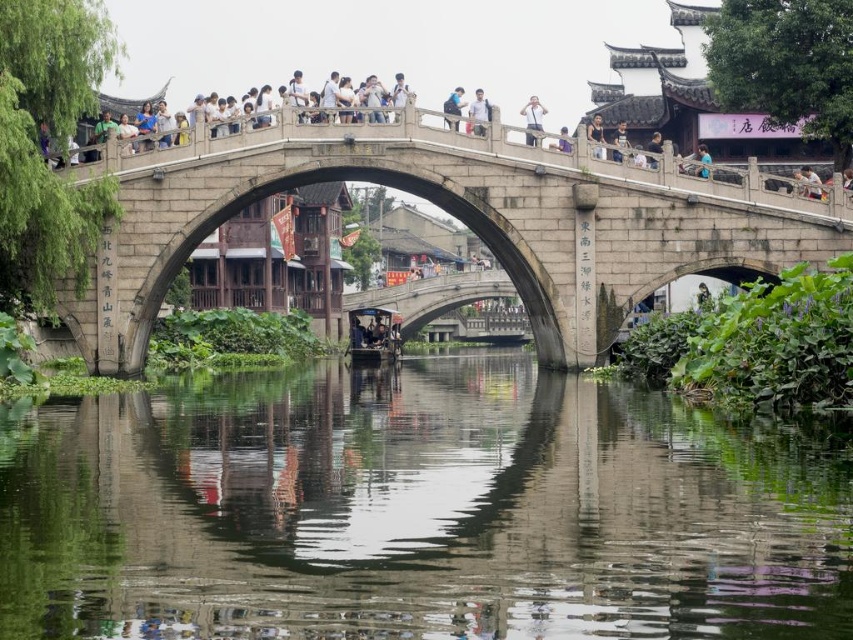
How much distance is there between gray stone bridge at center and light brown wooden fence at upper center?

gray stone bridge at center is 14.96 meters from light brown wooden fence at upper center.

Does gray stone bridge at center have a greater height compared to light brown wooden fence at upper center?

Indeed, gray stone bridge at center has a greater height compared to light brown wooden fence at upper center.

Is point (192, 188) farther from camera compared to point (601, 156)?

No, (192, 188) is in front of (601, 156).

This screenshot has height=640, width=853. What are the coordinates of `gray stone bridge at center` in the screenshot? It's located at (451, 216).

Which is behind, point (390, 339) or point (657, 144)?

The point (390, 339) is more distant.

Which of these two, wooden boat at center or dark blue shirt at upper center, stands shorter?

With less height is wooden boat at center.

Which is in front, point (384, 356) or point (653, 132)?

Point (384, 356)

Image resolution: width=853 pixels, height=640 pixels. Find the location of `wooden boat at center`. wooden boat at center is located at coordinates (373, 336).

Who is more distant from viewer, [263,529] or [567,145]?

Positioned behind is point [567,145].

Between point (473, 572) and point (566, 140), which one is positioned in front?

Point (473, 572) is in front.

Which is behind, point (345, 460) or point (567, 129)?

Positioned behind is point (567, 129).

Locate an element on the screen. transparent water at center is located at coordinates (416, 509).